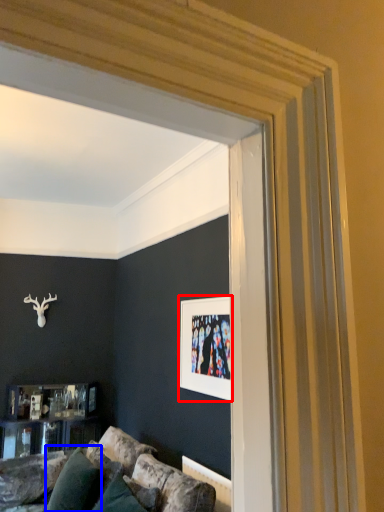
Question: Which of the following is the farthest to the observer, picture frame (highlighted by a red box) or pillow (highlighted by a blue box)?

Choices:
 (A) picture frame
 (B) pillow

Answer: (B)